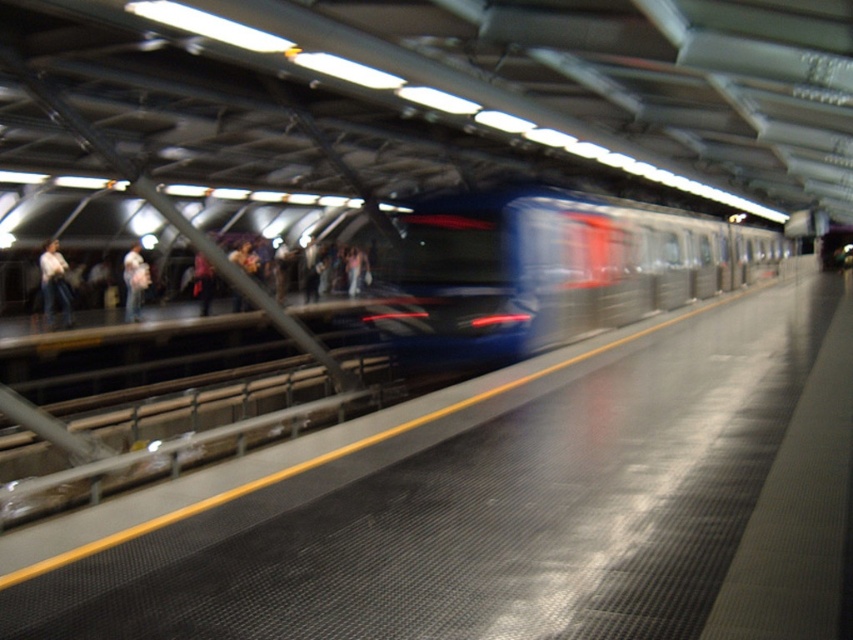
Is point (582, 300) behind point (45, 276)?

That is False.

Does point (703, 227) lie in front of point (45, 326)?

No, it is behind (45, 326).

This screenshot has width=853, height=640. Identify the location of metallic blue train at center. (550, 269).

Is white shirt at left to the right of light blue jeans at center from the viewer's perspective?

Incorrect, white shirt at left is not on the right side of light blue jeans at center.

Does white shirt at left have a larger size compared to light blue jeans at center?

Yes.

Is point (51, 301) positioned after point (131, 288)?

No, it is not.

Where is `white shirt at left`? The image size is (853, 640). white shirt at left is located at coordinates (54, 284).

Who is positioned more to the right, jeans at left or white shirt at left?

From the viewer's perspective, jeans at left appears more on the right side.

At what (x,y) coordinates should I click in order to perform the action: click on jeans at left. Please return your answer as a coordinate pair (x, y). Looking at the image, I should click on (189, 289).

Does point (115, 288) come farther from viewer compared to point (51, 291)?

Yes, it is.

This screenshot has width=853, height=640. In order to click on jeans at left in this screenshot , I will do `click(189, 289)`.